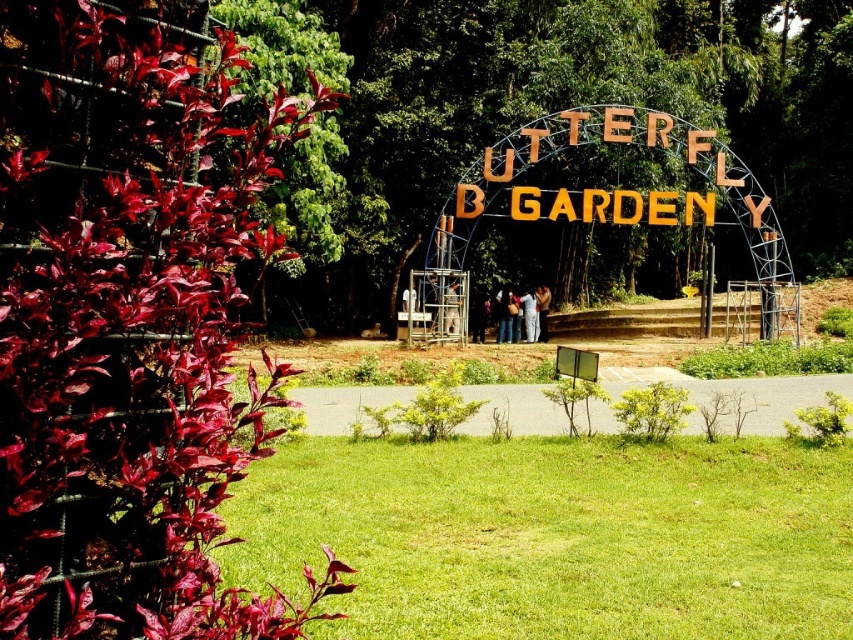
You are a photographer trying to capture the perfect shot of the matte blue shirt at center and the metallic silver person at center. Based on their positions, which object should you focus on first to ensure both are in sharp focus?

The metallic silver person at center should be focused on first since the matte blue shirt at center is above it, meaning the shirt is closer to the camera. By focusing on the closer object, both will be in focus if within the depth of field.

You are a visitor at the Butterfly Garden and want to take a photo of the arched sign. You are currently standing at the matte blue shirt at center. Which direction should you move to face the sign?

Since the matte blue shirt at center is located at point coordinates, you should move forward towards the arched sign which is the focal point in front of you.